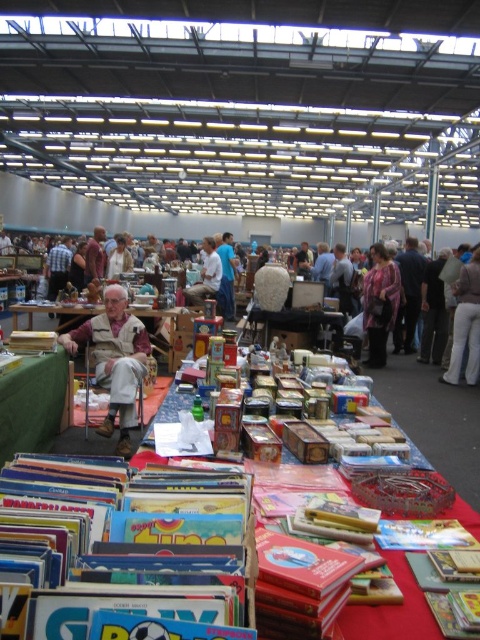
Question: Which of these objects is positioned farthest from the blue fabric pants at center?

Choices:
 (A) light brown leather jacket at center
 (B) patterned fabric jacket at center
 (C) red fabric tablecloth at center

Answer: (C)

Question: From the image, what is the correct spatial relationship of red fabric tablecloth at center in relation to light brown leather jacket at center?

Choices:
 (A) below
 (B) above

Answer: (A)

Question: Which point is farther from the camera taking this photo?

Choices:
 (A) (444, 376)
 (B) (156, 598)
 (C) (377, 289)
 (D) (427, 406)

Answer: (C)

Question: Is hardcover book at center to the left of light brown leather jacket at center from the viewer's perspective?

Choices:
 (A) yes
 (B) no

Answer: (B)

Question: Is white cotton pants at right closer to camera compared to blue fabric pants at center?

Choices:
 (A) no
 (B) yes

Answer: (B)

Question: Which of the following is the farthest from the observer?

Choices:
 (A) multicolored cardboard book at lower center
 (B) light brown leather jacket at center
 (C) red fabric tablecloth at center

Answer: (B)